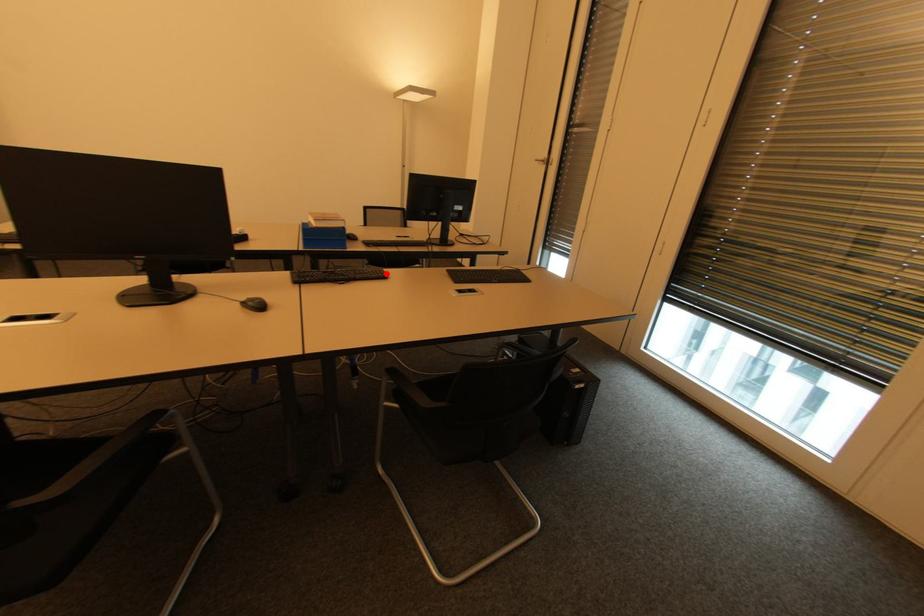
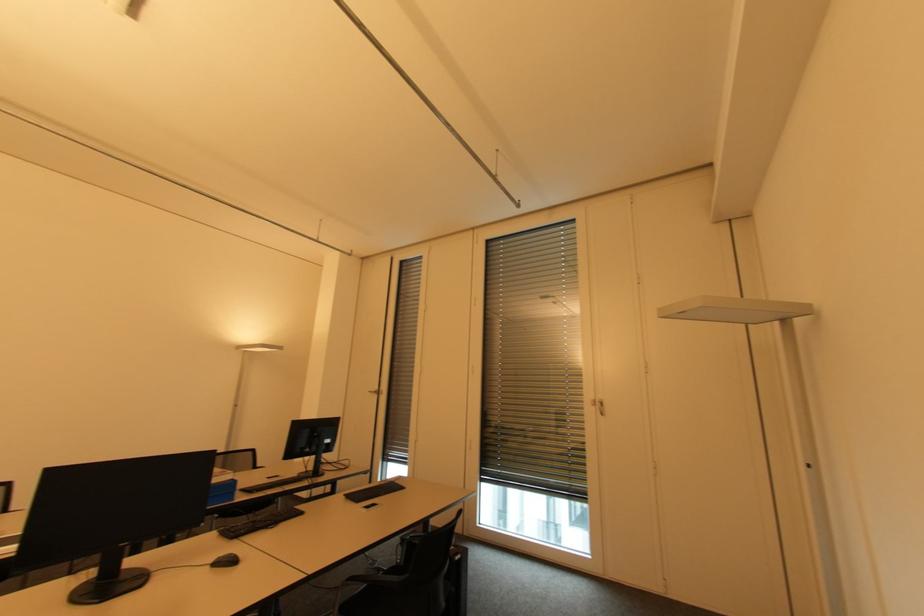
Question: I am providing you with two images of the same scene from different viewpoints. In image1, a red point is highlighted. Considering the same 3D point in image2, which of the following is correct?

Choices:
 (A) It is closer
 (B) It is farther

Answer: (A)